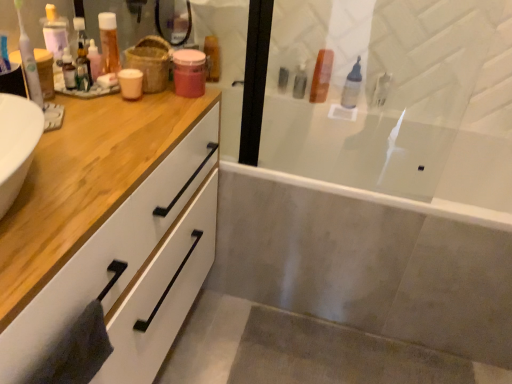
Identify the location of blank area beneath transparent glass screen door at upper center (from a real-world perspective). This screenshot has height=384, width=512. (290, 171).